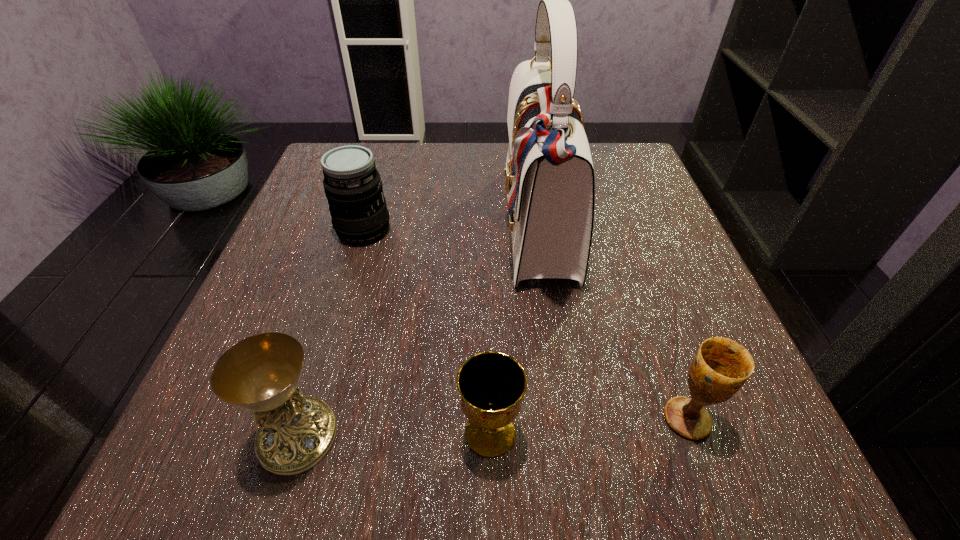
This screenshot has height=540, width=960. I want to click on empty location between the telephoto lens and the leftmost chalice, so click(x=330, y=333).

This screenshot has height=540, width=960. I want to click on free space between the rightmost object and the satchel, so click(x=613, y=323).

Identify which object is the second nearest to the satchel. Please provide its 2D coordinates. Your answer should be formatted as a tuple, i.e. [(x, y)], where the tuple contains the x and y coordinates of a point satisfying the conditions above.

[(492, 384)]

Locate an element on the screen. the second closest object to the rightmost object is located at coordinates (492, 384).

Select which chalice appears as the second closest to the telephoto lens. Please provide its 2D coordinates. Your answer should be formatted as a tuple, i.e. [(x, y)], where the tuple contains the x and y coordinates of a point satisfying the conditions above.

[(492, 384)]

The width and height of the screenshot is (960, 540). Identify the location of the third closest chalice to the tallest object. (260, 373).

This screenshot has width=960, height=540. I want to click on vacant region that satisfies the following two spatial constraints: 1. on the front-facing side of the tallest object; 2. on the left side of the rightmost chalice, so click(x=568, y=418).

Find the location of a particular element. The height and width of the screenshot is (540, 960). blank area in the image that satisfies the following two spatial constraints: 1. on the front side of the telephoto lens; 2. on the right side of the second chalice from right to left is located at coordinates (303, 432).